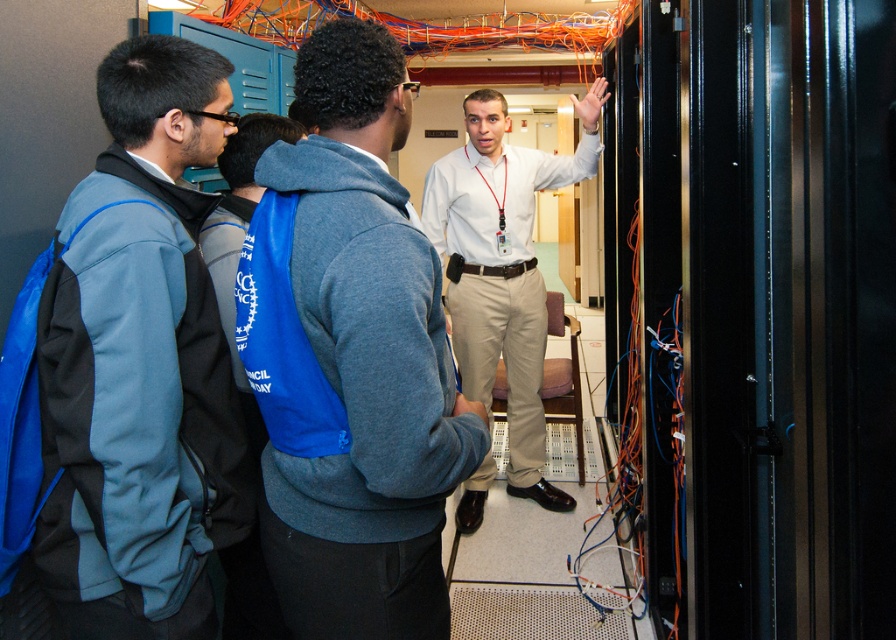
Between gray hoodie at center and white shirt at center, which one has less height?

gray hoodie at center is shorter.

Is gray hoodie at center below white shirt at center?

Correct, gray hoodie at center is located below white shirt at center.

This screenshot has width=896, height=640. I want to click on gray hoodie at center, so click(x=362, y=364).

From the picture: Can you confirm if blue fleece jacket at left is positioned below gray hoodie at center?

No, blue fleece jacket at left is not below gray hoodie at center.

Where is `blue fleece jacket at left`? The height and width of the screenshot is (640, 896). blue fleece jacket at left is located at coordinates (138, 360).

From the picture: Does blue fleece jacket at left have a larger size compared to white shirt at center?

No, blue fleece jacket at left is not bigger than white shirt at center.

Which is below, blue fleece jacket at left or white shirt at center?

blue fleece jacket at left is below.

At what (x,y) coordinates should I click in order to perform the action: click on blue fleece jacket at left. Please return your answer as a coordinate pair (x, y). Looking at the image, I should click on (138, 360).